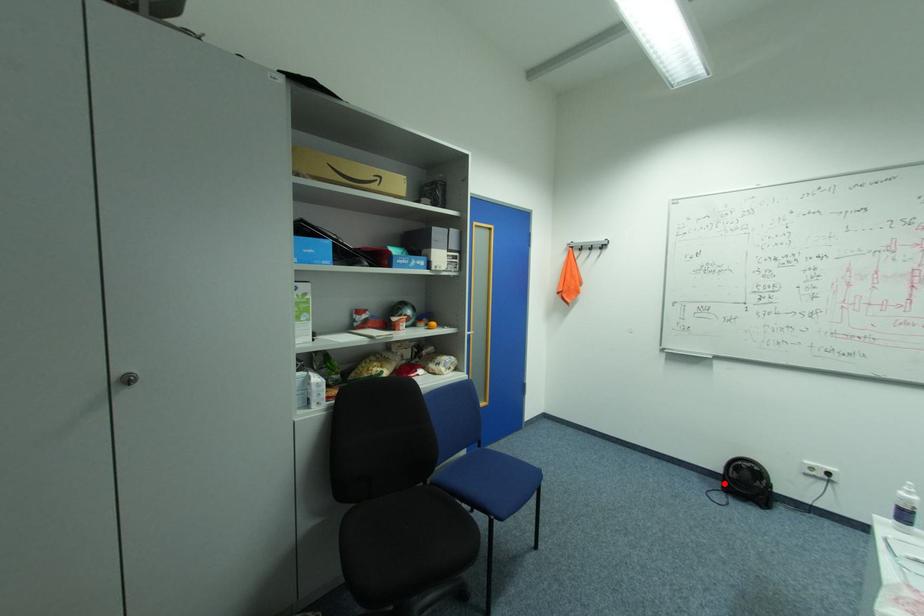
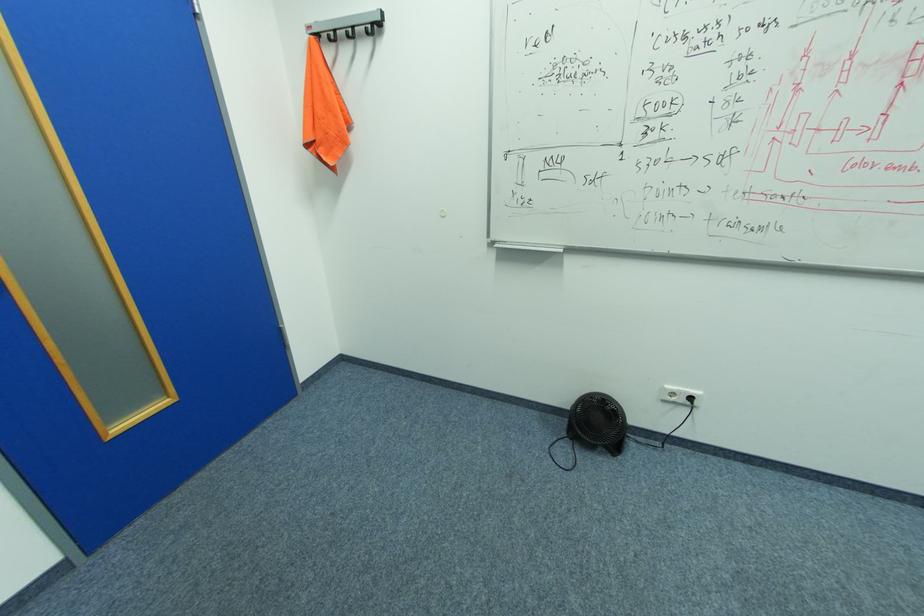
Locate, in the second image, the point that corresponds to the highlighted location in the first image.

(568, 423)